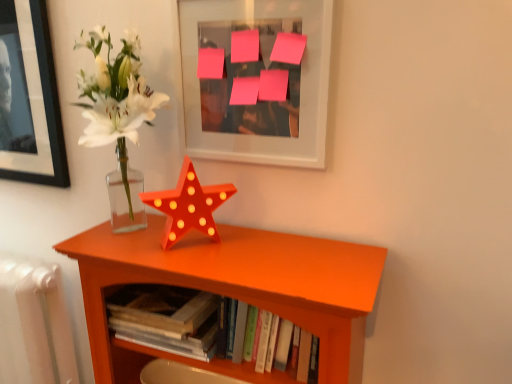
Question: From the image's perspective, is matte glass vase at center left positioned above or below pink paper at upper center?

Choices:
 (A) below
 (B) above

Answer: (A)

Question: From a real-world perspective, is matte glass vase at center left physically located above or below pink paper at upper center?

Choices:
 (A) above
 (B) below

Answer: (B)

Question: Considering the real-world distances, which object is closest to the hardcover books at center?

Choices:
 (A) matte glass vase at center left
 (B) pink paper at upper center
 (C) orange wood shelf at center
 (D) white plastic radiator at lower left

Answer: (C)

Question: Estimate the real-world distances between objects in this image. Which object is closer to the hardcover books at center?

Choices:
 (A) pink paper at upper center
 (B) white plastic radiator at lower left
 (C) orange wood shelf at center
 (D) matte glass vase at center left

Answer: (C)